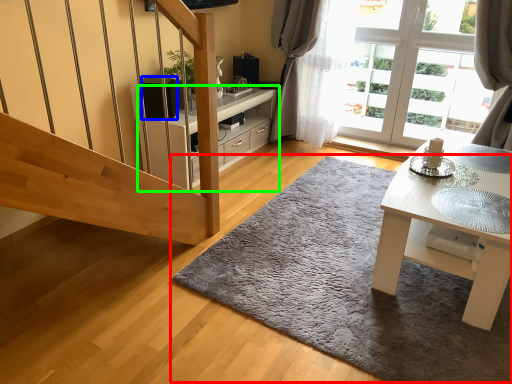
Question: Based on their relative distances, which object is nearer to doormat (highlighted by a red box)? Choose from speaker (highlighted by a blue box) and cabinetry (highlighted by a green box).

Choices:
 (A) speaker
 (B) cabinetry

Answer: (B)